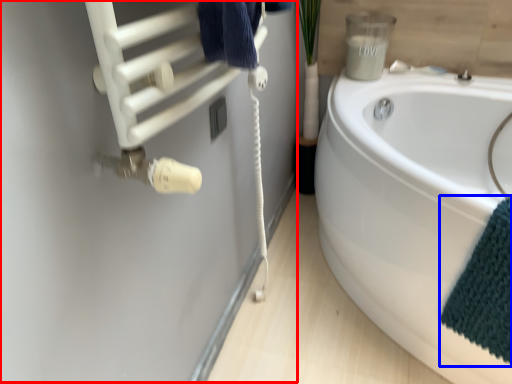
Question: Which point is closer to the camera, wool (highlighted by a red box) or bath towel (highlighted by a blue box)?

Choices:
 (A) wool
 (B) bath towel

Answer: (A)